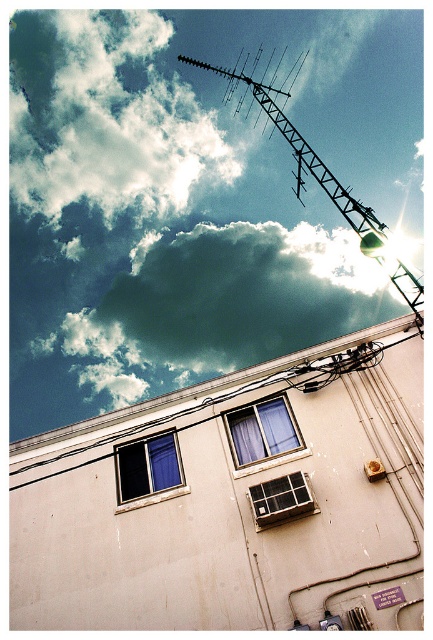
Looking at the building with its antenna and the cloudy sky above, which object takes up more space in the image? Mention both the cloudy sky at upper center and the white plastic window at center in your question.

The cloudy sky at upper center is bigger than the white plastic window at center, so the cloudy sky at upper center takes up more space in the image.

You are standing in front of the building and want to hang a banner between the cloudy sky at upper center and the white plastic window at center. The banner requires 50 meters of space. Will there be enough space?

The distance between the cloudy sky at upper center and the white plastic window at center is 52.90 meters, which is more than enough for the banner requiring 50 meters of space.

You are an architect designing a new building and want to ensure proper ventilation. You have two windows to choose from in the design plans. The blue glass window at center and the white plastic window at center. Which window should you select if you need the larger one for better airflow?

The blue glass window at center has a larger size compared to the white plastic window at center, so you should select the blue glass window at center for better airflow.